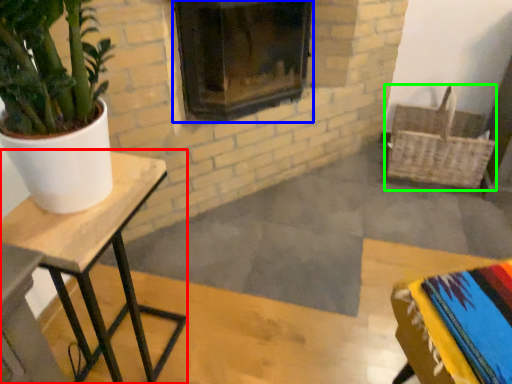
Question: Considering the real-world distances, which object is farthest from table (highlighted by a red box)? fireplace (highlighted by a blue box) or basket (highlighted by a green box)?

Choices:
 (A) fireplace
 (B) basket

Answer: (B)